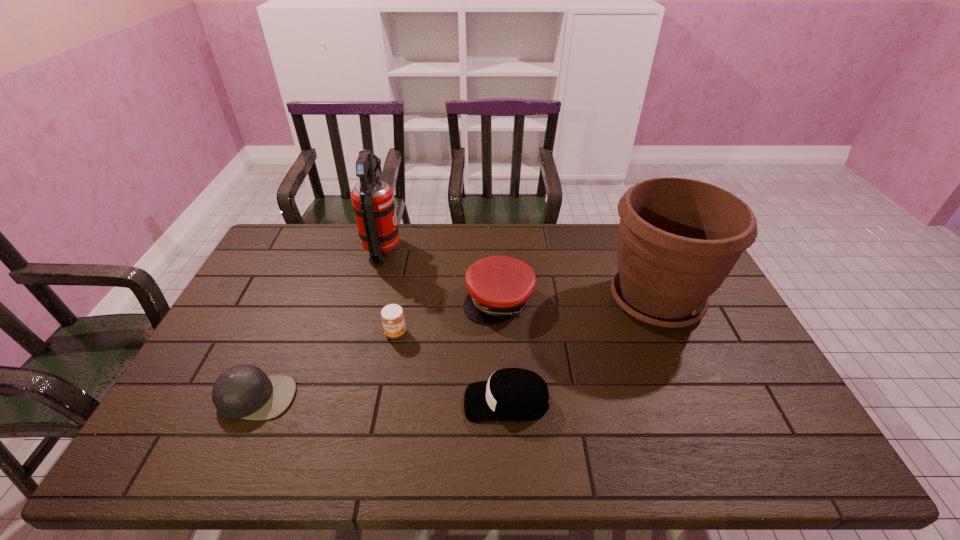
Locate an element on the screen. The width and height of the screenshot is (960, 540). empty location between the tallest cap and the flowerpot is located at coordinates (578, 300).

Image resolution: width=960 pixels, height=540 pixels. What are the coordinates of `free space that is in between the leftmost object and the jam` in the screenshot? It's located at (326, 365).

What are the coordinates of `free space between the fifth object from right to left and the tallest cap` in the screenshot? It's located at (441, 275).

The width and height of the screenshot is (960, 540). I want to click on vacant space that is in between the flowerpot and the jam, so click(526, 316).

Locate an element on the screen. The height and width of the screenshot is (540, 960). object that ranks as the third closest to the fifth object from right to left is located at coordinates (244, 391).

You are a GUI agent. You are given a task and a screenshot of the screen. Output one action in this format:
    pyautogui.click(x=<x>, y=<y>)
    Task: Click on the fifth closest object to the rightmost object
    This screenshot has height=540, width=960.
    Given the screenshot: What is the action you would take?
    pos(244,391)

Choose which cap is the second nearest neighbor to the fourth object from right to left. Please provide its 2D coordinates. Your answer should be formatted as a tuple, i.e. [(x, y)], where the tuple contains the x and y coordinates of a point satisfying the conditions above.

[(511, 394)]

I want to click on cap that is the nearest to the fifth object from right to left, so click(x=499, y=287).

Where is `vacant region that satisfies the following two spatial constraints: 1. on the front label side of the second object from left to right; 2. on the brim of the leftmost object`? vacant region that satisfies the following two spatial constraints: 1. on the front label side of the second object from left to right; 2. on the brim of the leftmost object is located at coordinates (344, 397).

Locate an element on the screen. This screenshot has width=960, height=540. vacant area that satisfies the following two spatial constraints: 1. on the front label side of the second object from left to right; 2. on the right side of the rightmost object is located at coordinates (370, 300).